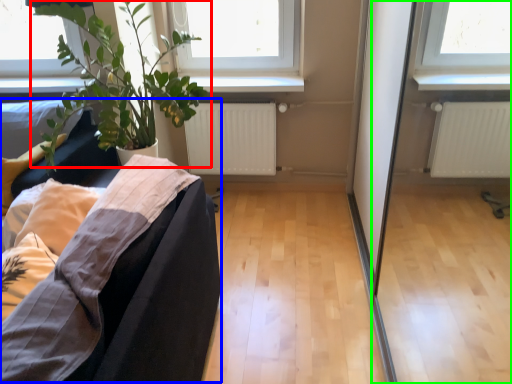
Question: Based on their relative distances, which object is farther from houseplant (highlighted by a red box)? Choose from couch (highlighted by a blue box) and screen door (highlighted by a green box).

Choices:
 (A) couch
 (B) screen door

Answer: (B)